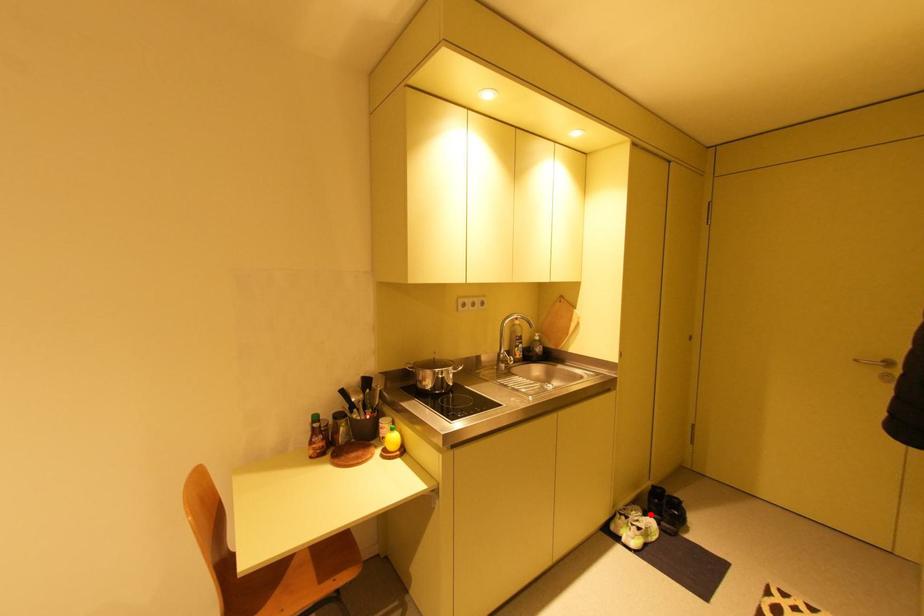
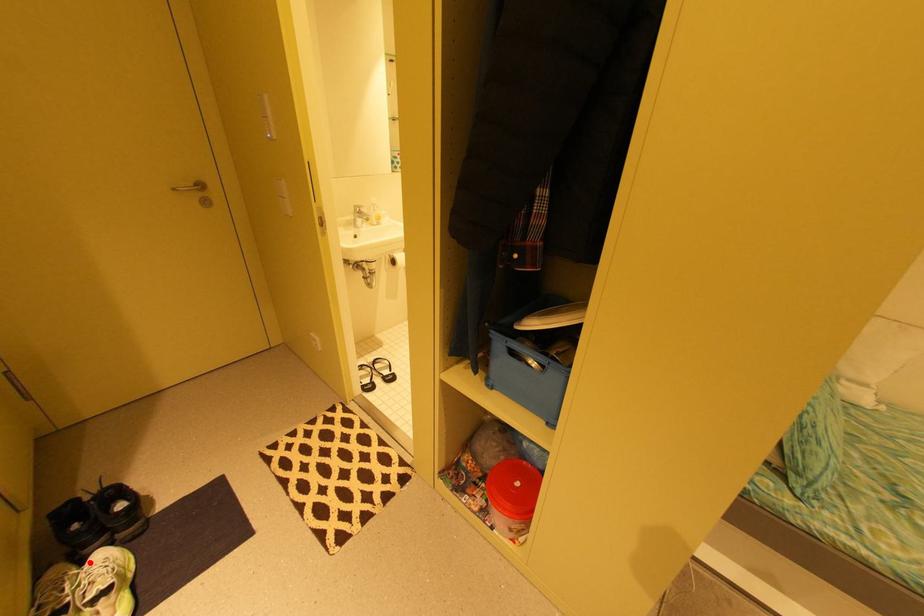
I am providing you with two images of the same scene from different viewpoints. A red point is marked on the first image and another point is marked on the second image. Do the highlighted points in image1 and image2 indicate the same real-world spot?

Yes